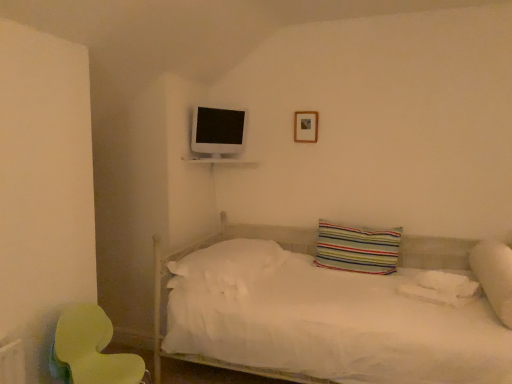
Question: Does white glossy shelf at upper center appear on the right side of white soft pillow at right, which is the third pillow from left to right?

Choices:
 (A) yes
 (B) no

Answer: (B)

Question: Does white glossy shelf at upper center have a larger size compared to white soft pillow at right, the first pillow in the right-to-left sequence?

Choices:
 (A) no
 (B) yes

Answer: (A)

Question: Considering the relative sizes of white glossy shelf at upper center and white soft pillow at right, the first pillow in the right-to-left sequence, in the image provided, is white glossy shelf at upper center thinner than white soft pillow at right, the first pillow in the right-to-left sequence,?

Choices:
 (A) yes
 (B) no

Answer: (A)

Question: Is white glossy shelf at upper center positioned before white soft pillow at right, which is the third pillow from left to right?

Choices:
 (A) no
 (B) yes

Answer: (A)

Question: Is white glossy shelf at upper center shorter than white soft pillow at right, the first pillow in the right-to-left sequence?

Choices:
 (A) no
 (B) yes

Answer: (B)

Question: From a real-world perspective, is white glossy shelf at upper center positioned above or below white soft pillow at right, which is the third pillow from left to right?

Choices:
 (A) above
 (B) below

Answer: (A)

Question: From their relative heights in the image, would you say white glossy shelf at upper center is taller or shorter than white soft pillow at right, the first pillow in the right-to-left sequence?

Choices:
 (A) short
 (B) tall

Answer: (A)

Question: Is white glossy shelf at upper center situated inside white soft pillow at right, which is the third pillow from left to right, or outside?

Choices:
 (A) outside
 (B) inside

Answer: (A)

Question: Considering the positions of point (186, 157) and point (501, 306), is point (186, 157) closer or farther from the camera than point (501, 306)?

Choices:
 (A) closer
 (B) farther

Answer: (B)

Question: Is striped fabric pillow at center, positioned as the 2th pillow in left-to-right order, bigger or smaller than white glossy shelf at upper center?

Choices:
 (A) big
 (B) small

Answer: (A)

Question: Is striped fabric pillow at center, positioned as the 2th pillow in left-to-right order, taller or shorter than white glossy shelf at upper center?

Choices:
 (A) tall
 (B) short

Answer: (A)

Question: Considering the positions of point coord(358,263) and point coord(219,157), is point coord(358,263) closer or farther from the camera than point coord(219,157)?

Choices:
 (A) farther
 (B) closer

Answer: (B)

Question: Considering the relative positions of striped fabric pillow at center, positioned as the 2th pillow in left-to-right order, and white glossy shelf at upper center in the image provided, is striped fabric pillow at center, positioned as the 2th pillow in left-to-right order, to the left or to the right of white glossy shelf at upper center?

Choices:
 (A) right
 (B) left

Answer: (A)

Question: From a real-world perspective, is white soft pillow at right, which is the third pillow from left to right, positioned above or below white soft pillow at center, acting as the 3th pillow starting from the right?

Choices:
 (A) above
 (B) below

Answer: (A)

Question: Looking at their shapes, would you say white soft pillow at right, the first pillow in the right-to-left sequence, is wider or thinner than white soft pillow at center, which is counted as the first pillow, starting from the left?

Choices:
 (A) thin
 (B) wide

Answer: (B)